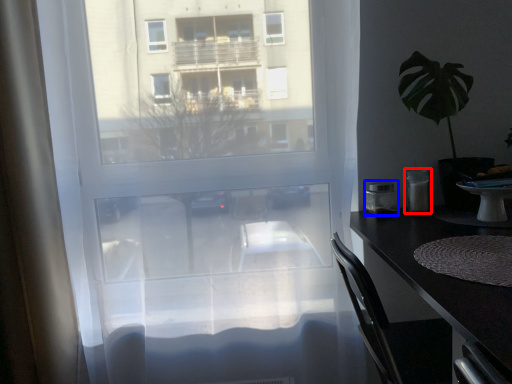
Question: Which object appears closest to the camera in this image, appliance (highlighted by a red box) or appliance (highlighted by a blue box)?

Choices:
 (A) appliance
 (B) appliance

Answer: (A)